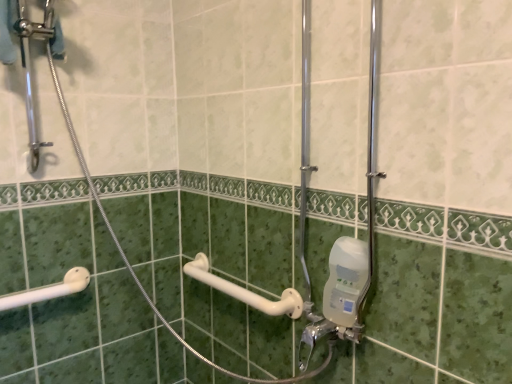
Question: Does white plastic grab bar at lower left have a larger size compared to clear plastic soap dispenser at lower right?

Choices:
 (A) no
 (B) yes

Answer: (B)

Question: Considering the relative sizes of white plastic grab bar at lower left and clear plastic soap dispenser at lower right in the image provided, is white plastic grab bar at lower left wider than clear plastic soap dispenser at lower right?

Choices:
 (A) no
 (B) yes

Answer: (B)

Question: Would you say clear plastic soap dispenser at lower right is part of white plastic grab bar at lower left's contents?

Choices:
 (A) yes
 (B) no

Answer: (B)

Question: Is white plastic grab bar at lower left at the right side of clear plastic soap dispenser at lower right?

Choices:
 (A) no
 (B) yes

Answer: (A)

Question: Is the position of white plastic grab bar at lower left more distant than that of clear plastic soap dispenser at lower right?

Choices:
 (A) no
 (B) yes

Answer: (B)

Question: Is clear plastic soap dispenser at lower right at the back of white plastic grab bar at lower left?

Choices:
 (A) no
 (B) yes

Answer: (A)

Question: From a real-world perspective, is white plastic grab bar at lower left positioned under white plastic towel bar at center based on gravity?

Choices:
 (A) yes
 (B) no

Answer: (B)

Question: Does white plastic grab bar at lower left appear on the right side of white plastic towel bar at center?

Choices:
 (A) no
 (B) yes

Answer: (A)

Question: Considering the relative sizes of white plastic grab bar at lower left and white plastic towel bar at center in the image provided, is white plastic grab bar at lower left shorter than white plastic towel bar at center?

Choices:
 (A) no
 (B) yes

Answer: (B)

Question: Is white plastic grab bar at lower left not close to white plastic towel bar at center?

Choices:
 (A) no
 (B) yes

Answer: (A)

Question: Is white plastic grab bar at lower left closer to the viewer compared to white plastic towel bar at center?

Choices:
 (A) yes
 (B) no

Answer: (B)

Question: Could you tell me if white plastic grab bar at lower left is turned towards white plastic towel bar at center?

Choices:
 (A) yes
 (B) no

Answer: (B)

Question: From the image's perspective, is clear plastic soap dispenser at lower right located above white plastic towel bar at center?

Choices:
 (A) no
 (B) yes

Answer: (B)